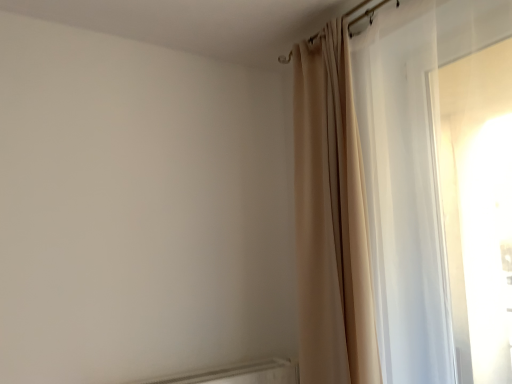
What do you see at coordinates (331, 218) in the screenshot? This screenshot has height=384, width=512. I see `beige fabric curtain at upper right, the second curtain when ordered from right to left` at bounding box center [331, 218].

How much space does beige fabric curtain at upper right, arranged as the 1th curtain when viewed from the left, occupy horizontally?

It is 13.06 inches.

Find the location of a particular element. beige fabric curtain at upper right, arranged as the 1th curtain when viewed from the left is located at coordinates (331, 218).

Locate an element on the screen. Image resolution: width=512 pixels, height=384 pixels. sheer white curtain at right, the 2th curtain positioned from the left is located at coordinates (402, 196).

The height and width of the screenshot is (384, 512). Describe the element at coordinates (402, 196) in the screenshot. I see `sheer white curtain at right, which is counted as the 1th curtain, starting from the right` at that location.

This screenshot has height=384, width=512. Identify the location of beige fabric curtain at upper right, arranged as the 1th curtain when viewed from the left. (331, 218).

Which is more to the right, sheer white curtain at right, the 2th curtain positioned from the left, or beige fabric curtain at upper right, the second curtain when ordered from right to left?

From the viewer's perspective, sheer white curtain at right, the 2th curtain positioned from the left, appears more on the right side.

Which object is more forward, sheer white curtain at right, the 2th curtain positioned from the left, or beige fabric curtain at upper right, arranged as the 1th curtain when viewed from the left?

sheer white curtain at right, the 2th curtain positioned from the left, is more forward.

Considering the points (388, 261) and (337, 173), which point is in front, point (388, 261) or point (337, 173)?

The point (388, 261) is in front.

From the image's perspective, is sheer white curtain at right, the 2th curtain positioned from the left, over beige fabric curtain at upper right, arranged as the 1th curtain when viewed from the left?

Yes.

From a real-world perspective, is sheer white curtain at right, the 2th curtain positioned from the left, positioned under beige fabric curtain at upper right, arranged as the 1th curtain when viewed from the left, based on gravity?

Incorrect, from a real-world perspective, sheer white curtain at right, the 2th curtain positioned from the left, is higher than beige fabric curtain at upper right, arranged as the 1th curtain when viewed from the left.

Which object is thinner, sheer white curtain at right, the 2th curtain positioned from the left, or beige fabric curtain at upper right, arranged as the 1th curtain when viewed from the left?

sheer white curtain at right, the 2th curtain positioned from the left, is thinner.

Between sheer white curtain at right, which is counted as the 1th curtain, starting from the right, and beige fabric curtain at upper right, the second curtain when ordered from right to left, which one has less height?

sheer white curtain at right, which is counted as the 1th curtain, starting from the right, is shorter.

Considering the sizes of objects sheer white curtain at right, which is counted as the 1th curtain, starting from the right, and beige fabric curtain at upper right, the second curtain when ordered from right to left, in the image provided, who is bigger, sheer white curtain at right, which is counted as the 1th curtain, starting from the right, or beige fabric curtain at upper right, the second curtain when ordered from right to left,?

sheer white curtain at right, which is counted as the 1th curtain, starting from the right.

Is beige fabric curtain at upper right, the second curtain when ordered from right to left, located within sheer white curtain at right, the 2th curtain positioned from the left?

No, beige fabric curtain at upper right, the second curtain when ordered from right to left, is not surrounded by sheer white curtain at right, the 2th curtain positioned from the left.

Is sheer white curtain at right, which is counted as the 1th curtain, starting from the right, far from beige fabric curtain at upper right, arranged as the 1th curtain when viewed from the left?

They are positioned close to each other.

Is sheer white curtain at right, which is counted as the 1th curtain, starting from the right, oriented towards beige fabric curtain at upper right, the second curtain when ordered from right to left?

No, sheer white curtain at right, which is counted as the 1th curtain, starting from the right, is not turned towards beige fabric curtain at upper right, the second curtain when ordered from right to left.

Locate an element on the screen. Image resolution: width=512 pixels, height=384 pixels. curtain lying behind the sheer white curtain at right, which is counted as the 1th curtain, starting from the right is located at coordinates (331, 218).

In the image, is beige fabric curtain at upper right, arranged as the 1th curtain when viewed from the left, on the left side or the right side of sheer white curtain at right, the 2th curtain positioned from the left?

beige fabric curtain at upper right, arranged as the 1th curtain when viewed from the left, is to the left of sheer white curtain at right, the 2th curtain positioned from the left.

Is beige fabric curtain at upper right, arranged as the 1th curtain when viewed from the left, closer to the viewer compared to sheer white curtain at right, which is counted as the 1th curtain, starting from the right?

No, the depth of beige fabric curtain at upper right, arranged as the 1th curtain when viewed from the left, is greater than that of sheer white curtain at right, which is counted as the 1th curtain, starting from the right.

Does point (362, 311) come in front of point (352, 286)?

That is True.

From the image's perspective, which one is positioned lower, beige fabric curtain at upper right, the second curtain when ordered from right to left, or sheer white curtain at right, which is counted as the 1th curtain, starting from the right?

From the image's view, beige fabric curtain at upper right, the second curtain when ordered from right to left, is below.

From a real-world perspective, is beige fabric curtain at upper right, arranged as the 1th curtain when viewed from the left, located beneath sheer white curtain at right, which is counted as the 1th curtain, starting from the right?

Yes.

Considering the relative sizes of beige fabric curtain at upper right, the second curtain when ordered from right to left, and sheer white curtain at right, the 2th curtain positioned from the left, in the image provided, is beige fabric curtain at upper right, the second curtain when ordered from right to left, wider than sheer white curtain at right, the 2th curtain positioned from the left,?

Indeed, beige fabric curtain at upper right, the second curtain when ordered from right to left, has a greater width compared to sheer white curtain at right, the 2th curtain positioned from the left.

From their relative heights in the image, would you say beige fabric curtain at upper right, the second curtain when ordered from right to left, is taller or shorter than sheer white curtain at right, which is counted as the 1th curtain, starting from the right?

Considering their sizes, beige fabric curtain at upper right, the second curtain when ordered from right to left, has more height than sheer white curtain at right, which is counted as the 1th curtain, starting from the right.

Who is bigger, beige fabric curtain at upper right, arranged as the 1th curtain when viewed from the left, or sheer white curtain at right, which is counted as the 1th curtain, starting from the right?

sheer white curtain at right, which is counted as the 1th curtain, starting from the right.

Is beige fabric curtain at upper right, arranged as the 1th curtain when viewed from the left, inside the boundaries of sheer white curtain at right, the 2th curtain positioned from the left, or outside?

beige fabric curtain at upper right, arranged as the 1th curtain when viewed from the left, lies outside sheer white curtain at right, the 2th curtain positioned from the left.

Are beige fabric curtain at upper right, arranged as the 1th curtain when viewed from the left, and sheer white curtain at right, the 2th curtain positioned from the left, located far from each other?

No.

Is beige fabric curtain at upper right, the second curtain when ordered from right to left, turned away from sheer white curtain at right, which is counted as the 1th curtain, starting from the right?

No, beige fabric curtain at upper right, the second curtain when ordered from right to left, is not facing away from sheer white curtain at right, which is counted as the 1th curtain, starting from the right.

Measure the distance between beige fabric curtain at upper right, the second curtain when ordered from right to left, and sheer white curtain at right, which is counted as the 1th curtain, starting from the right.

beige fabric curtain at upper right, the second curtain when ordered from right to left, and sheer white curtain at right, which is counted as the 1th curtain, starting from the right, are 11.97 centimeters apart from each other.

Where is `curtain behind the sheer white curtain at right, the 2th curtain positioned from the left`? The image size is (512, 384). curtain behind the sheer white curtain at right, the 2th curtain positioned from the left is located at coordinates (331, 218).

This screenshot has height=384, width=512. Find the location of `curtain behind the sheer white curtain at right, the 2th curtain positioned from the left`. curtain behind the sheer white curtain at right, the 2th curtain positioned from the left is located at coordinates (331, 218).

Where is `curtain above the beige fabric curtain at upper right, the second curtain when ordered from right to left (from a real-world perspective)`? curtain above the beige fabric curtain at upper right, the second curtain when ordered from right to left (from a real-world perspective) is located at coordinates (402, 196).